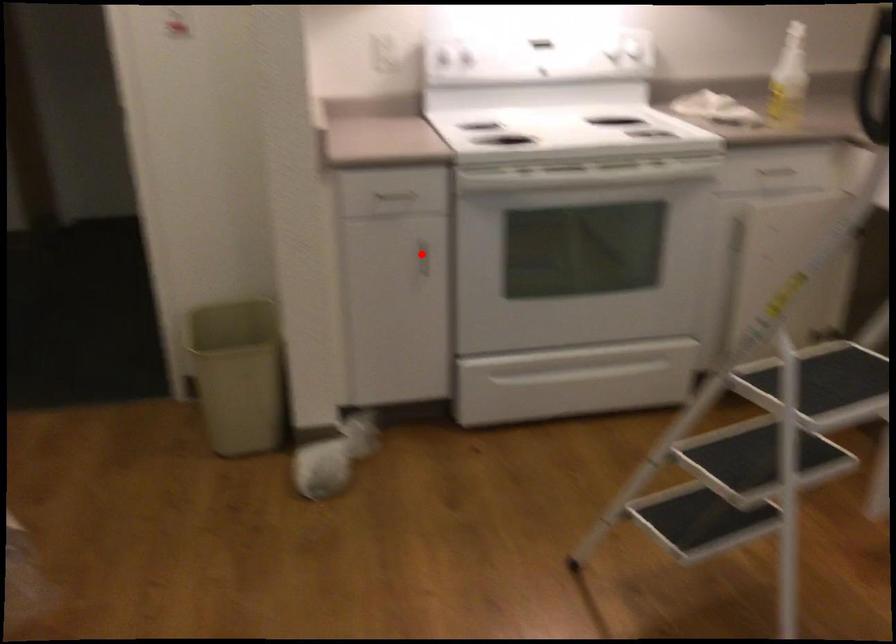
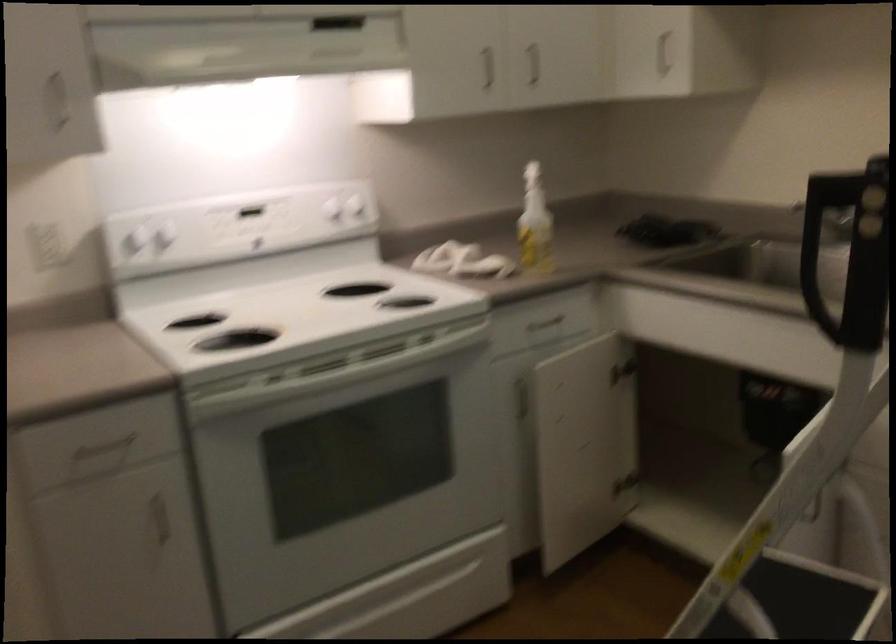
Question: I am providing you with two images of the same scene from different viewpoints. In image1, a red point is highlighted. Considering the same 3D point in image2, which of the following is correct?

Choices:
 (A) It is closer
 (B) It is farther

Answer: (A)